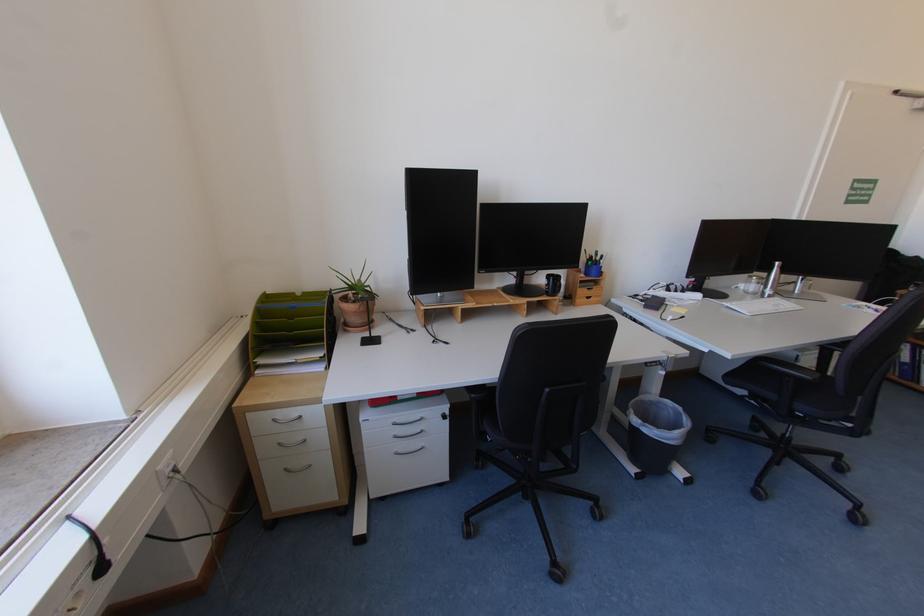
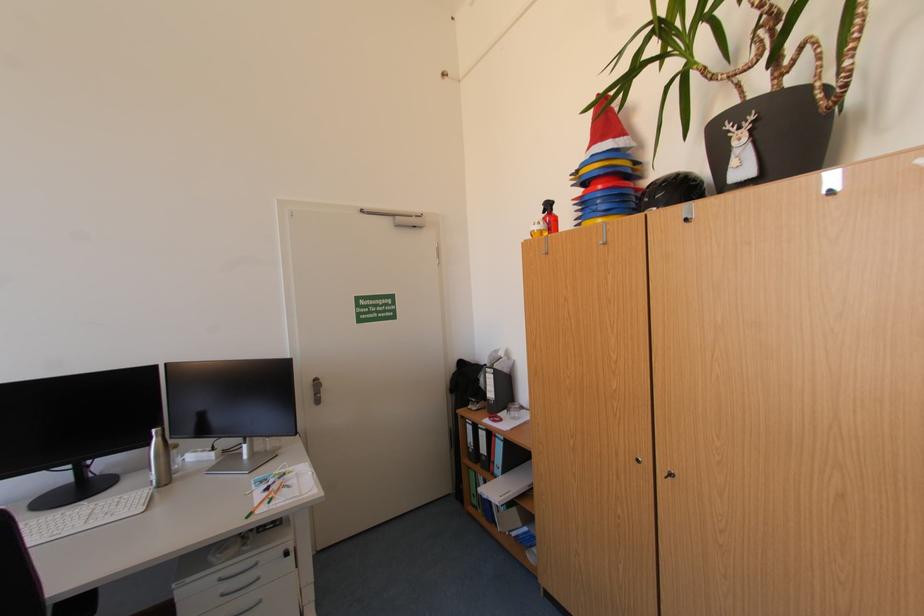
Find the pixel in the second image that matches point 784,264 in the first image.

(161, 431)